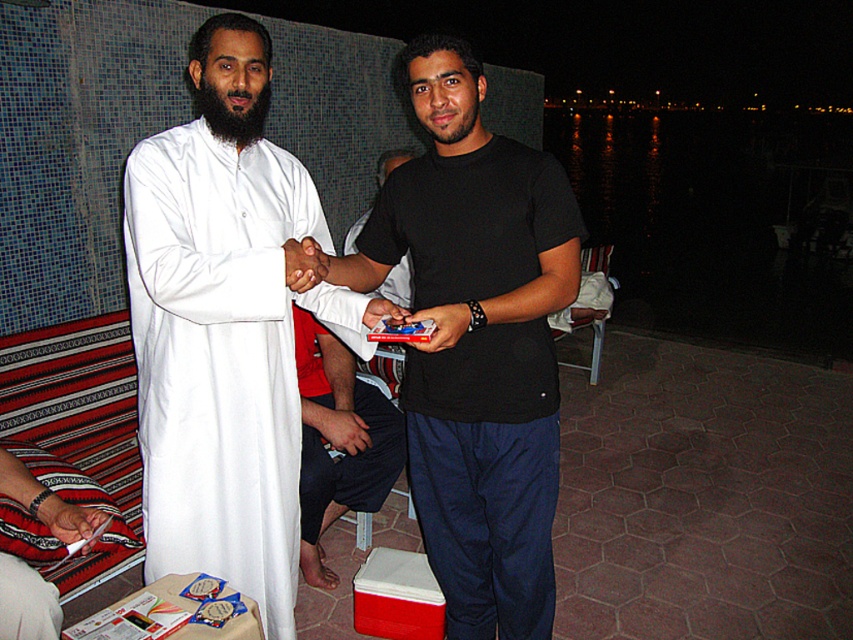
You are a photographer trying to capture a closeup of the dark blue cotton pants at center and the smooth skin hand at center in the scene. Which object is positioned closer to the camera?

The dark blue cotton pants at center is closer to the viewer than the smooth skin hand at center, so the dark blue cotton pants at center would appear larger in the photo.

You are a delivery person who needs to place a matte plastic card at center into a card reader that is 10 inches away. Can you reach it with your matte white hand at center?

The matte white hand at center is 9.77 inches from the matte plastic card at center, so yes, the delivery person can reach the matte plastic card at center with their matte white hand at center since the distance is within reach.

You are standing at the origin point in the scene. You see two points marked in the image. Which point is closer to you, point (549, 193) or point (340, 426)?

Point (549, 193) is in front of point (340, 426), so it is closer to you.